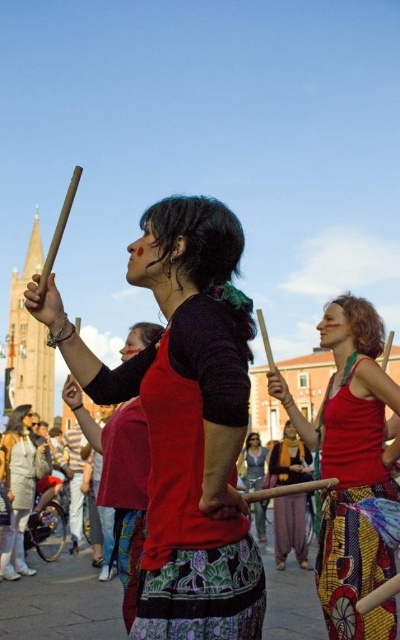
In the scene, there are three performers wearing red tops. The one at the center is marked by point (350, 467). If you were standing in the square facing the performers, which direction would the matte red tank top at center be from you?

The matte red tank top at center is located at point (350, 467), which is in the center of the scene. Since you are facing the performers, the matte red tank top at center would be directly in front of you.

You are a photographer standing in the crowd at the event. You want to capture a photo that includes both the matte red tank top at center and the matte silver helmet at lower left. Which object should you position closer to the front of your camera frame to ensure both are visible?

The matte silver helmet at lower left is shorter than the matte red tank top at center, so to ensure both are visible in the photo, position the matte silver helmet at lower left closer to the front of your camera frame. This way, its shorter height won